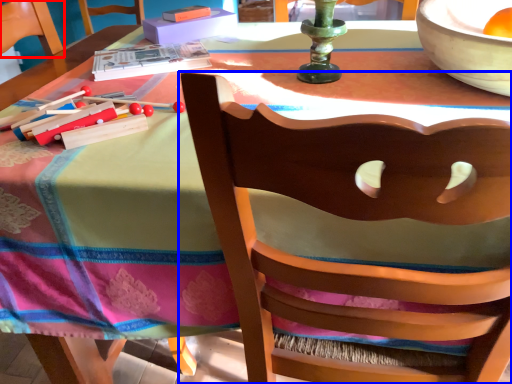
Question: Which object is further to the camera taking this photo, armchair (highlighted by a red box) or chair (highlighted by a blue box)?

Choices:
 (A) armchair
 (B) chair

Answer: (A)